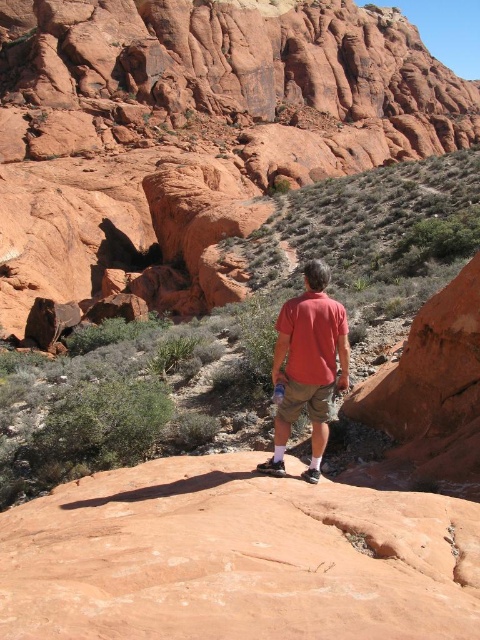
You are a photographer trying to capture the person in the image. Since the matte red shirt at center and the khaki cotton shorts at center are both in the frame, can you tell which clothing item is visible higher up on the person?

The matte red shirt at center is positioned over the khaki cotton shorts at center, so the matte red shirt at center is visible higher up on the person.

You are a photographer planning to take a portrait of the person in the scene. You need to ensure that both the matte red shirt at center and the khaki cotton shorts at center are clearly visible in the frame. Considering their sizes, which object should you focus on to make sure both are in focus?

The matte red shirt at center is bigger than khaki cotton shorts at center, so focusing on the matte red shirt at center will ensure both are in focus since it is larger and closer to the camera.